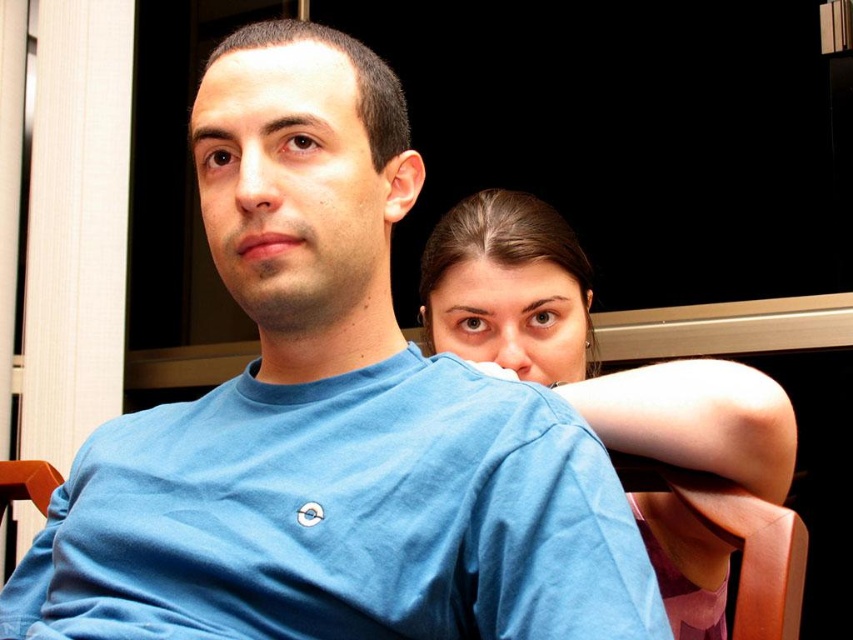
Is point (706, 365) less distant than point (645, 476)?

Yes.

Between smooth skin face at upper right and brown wood chair at lower right, which one is positioned lower?

Positioned lower is brown wood chair at lower right.

Between point (526, 248) and point (621, 465), which one is positioned in front?

Positioned in front is point (621, 465).

Find the location of a particular element. The width and height of the screenshot is (853, 640). smooth skin face at upper right is located at coordinates (592, 346).